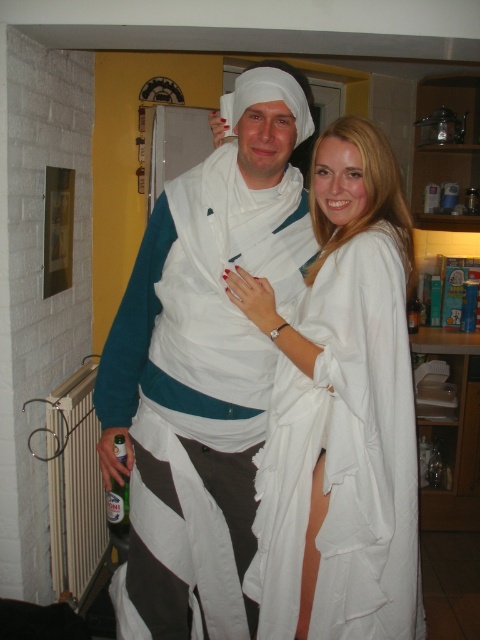
Question: Can you confirm if white cotton toga at center is positioned to the right of white fabric dress at center?

Choices:
 (A) no
 (B) yes

Answer: (A)

Question: Which point appears farthest from the camera in this image?

Choices:
 (A) (168, 637)
 (B) (363, 284)

Answer: (A)

Question: Which of the following is the closest to the observer?

Choices:
 (A) (294, 564)
 (B) (252, 192)

Answer: (A)

Question: From the image, what is the correct spatial relationship of white cotton toga at center in relation to white fabric dress at center?

Choices:
 (A) below
 (B) above

Answer: (B)

Question: Is white cotton toga at center bigger than white fabric dress at center?

Choices:
 (A) no
 (B) yes

Answer: (B)

Question: Which point appears closest to the camera in this image?

Choices:
 (A) (218, 304)
 (B) (362, 376)

Answer: (B)